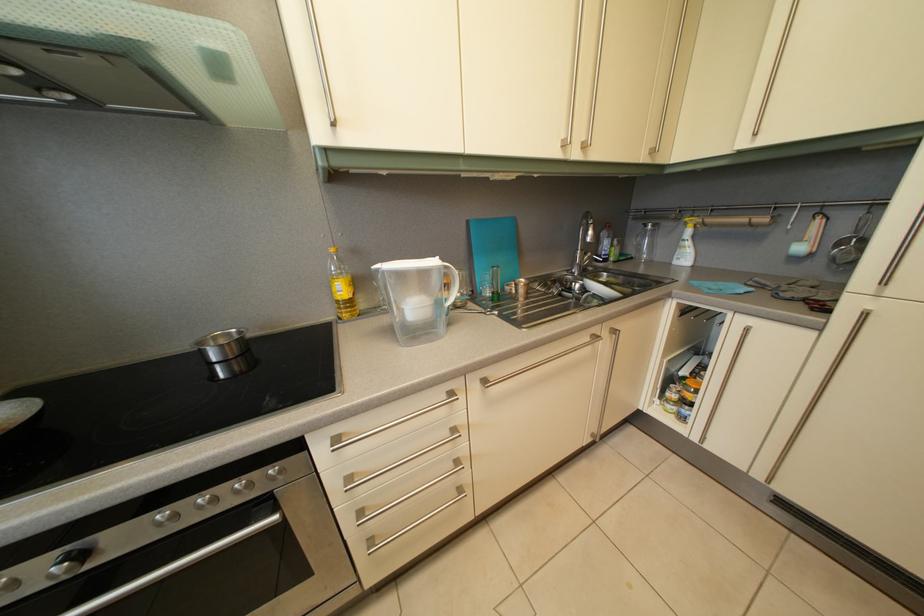
Describe the element at coordinates (453, 283) in the screenshot. The width and height of the screenshot is (924, 616). I see `a white pitcher handle` at that location.